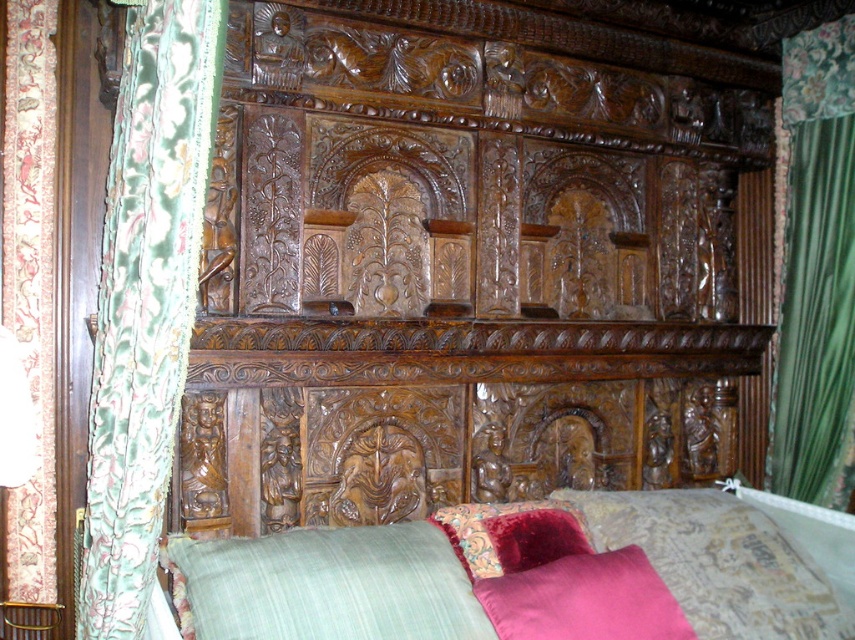
You are arranging a historical bedroom scene and need to place both the velvet pink pillow at lower right and the velvet fabric curtain at left. Considering their sizes, which object would require more space when positioning them?

The velvet pink pillow at lower right requires more space when positioning because it has a larger size compared to the velvet fabric curtain at left.

You are arranging flowers on a wooden bed frame. You have two pillows, the green fabric pillow at lower center and the velvet pink pillow at lower right. Where should you place the flowers so they are visible from the front of the bed?

Place the flowers on the green fabric pillow at lower center because it is in front of the velvet pink pillow at lower right, making it more visible from the front of the bed.

You are standing in front of the wooden bed frame and want to place a small decorative item on the bed. The bed has a velvet pink pillow at lower right. Based on the coordinates provided, where should you place the item to ensure it is centered between the headboard and the footboard?

The velvet pink pillow at lower right is located at coordinates point (x=721, y=561). To center the item between the headboard and footboard, place it along the vertical axis midway between these two points.